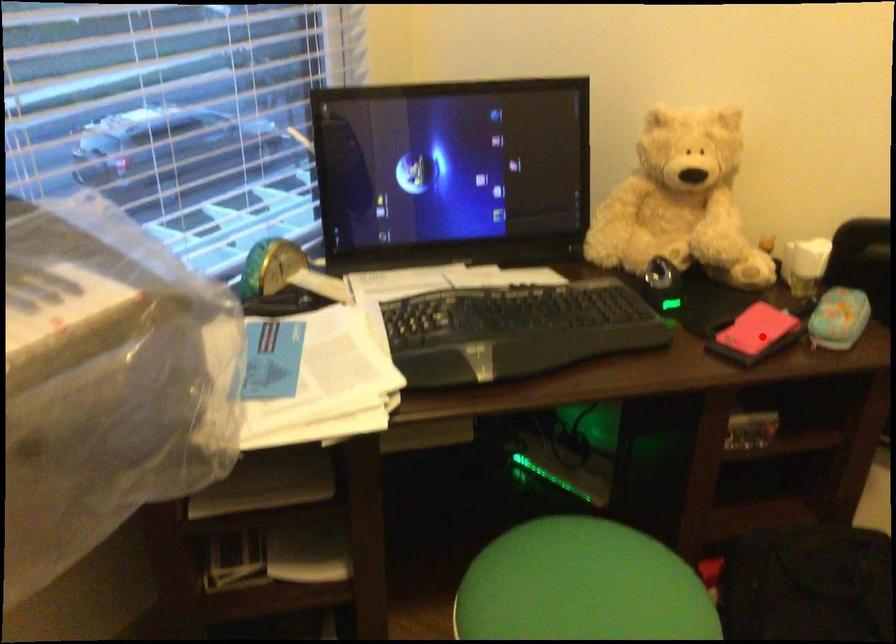
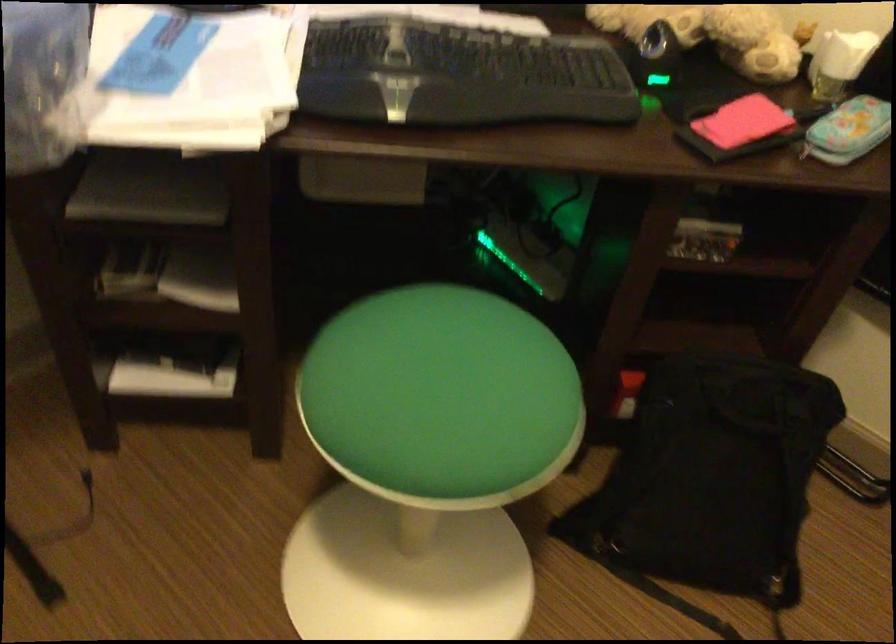
Find the pixel in the second image that matches the highlighted location in the first image.

(739, 128)